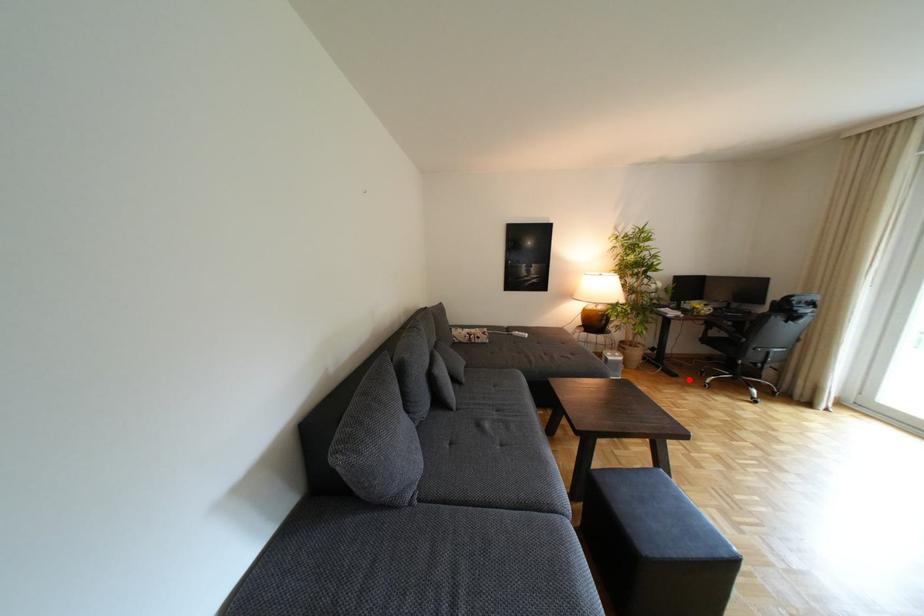
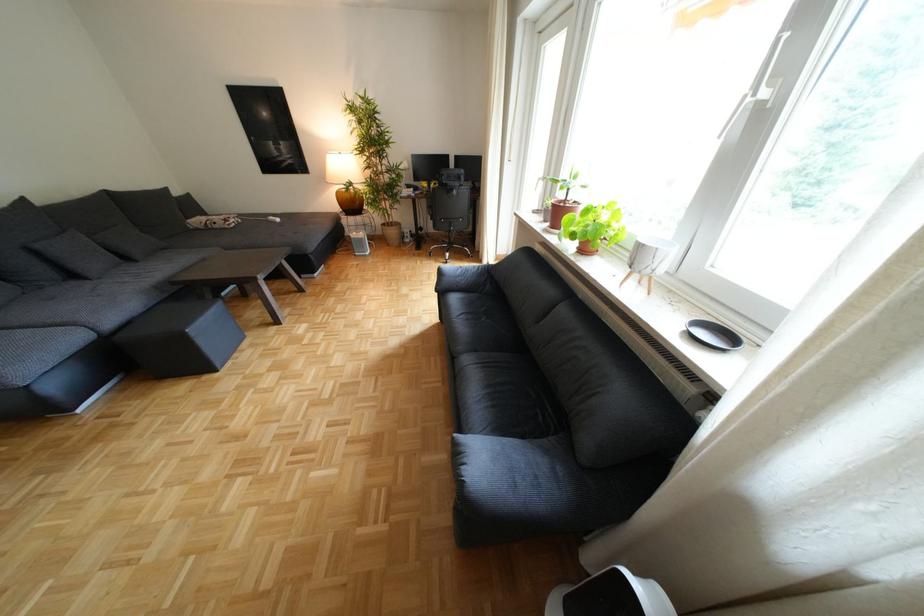
Where in the second image is the point corresponding to the highlighted location from the first image?

(430, 252)